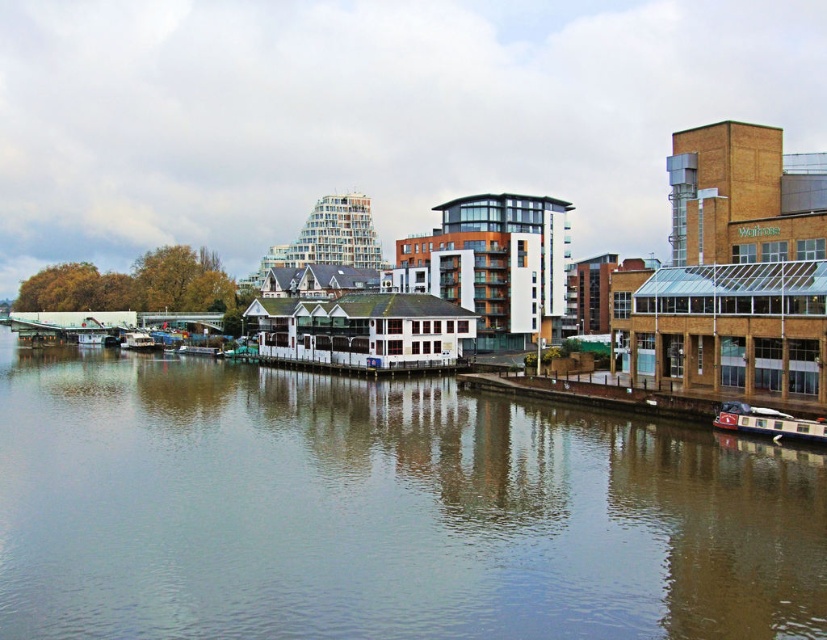
Between brown water at center and red polished wood boat at lower right, which one appears on the left side from the viewer's perspective?

brown water at center

Which is behind, point (233, 401) or point (782, 436)?

The point (233, 401) is more distant.

Identify the location of brown water at center. (381, 509).

Which is more to the right, red polished wood boat at lower right or metallic silver boat at left?

Positioned to the right is red polished wood boat at lower right.

Does red polished wood boat at lower right come in front of metallic silver boat at left?

Yes, it is.

What are the coordinates of `red polished wood boat at lower right` in the screenshot? It's located at (768, 422).

Is brown water at center wider than metallic silver boat at left?

Yes, brown water at center is wider than metallic silver boat at left.

Is brown water at center taller than metallic silver boat at left?

Correct, brown water at center is much taller as metallic silver boat at left.

Is point (575, 557) behind point (137, 348)?

No, it is not.

Find the location of a particular element. This screenshot has height=640, width=827. brown water at center is located at coordinates (381, 509).